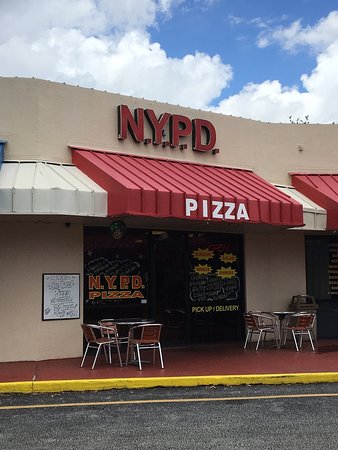
The width and height of the screenshot is (338, 450). Find the location of `black border of whiteboard`. black border of whiteboard is located at coordinates (79, 293).